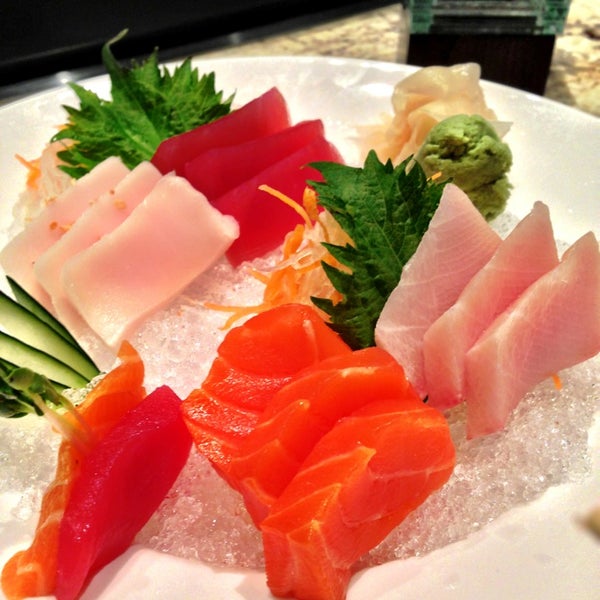
The height and width of the screenshot is (600, 600). Find the location of `plate`. plate is located at coordinates point(188,525).